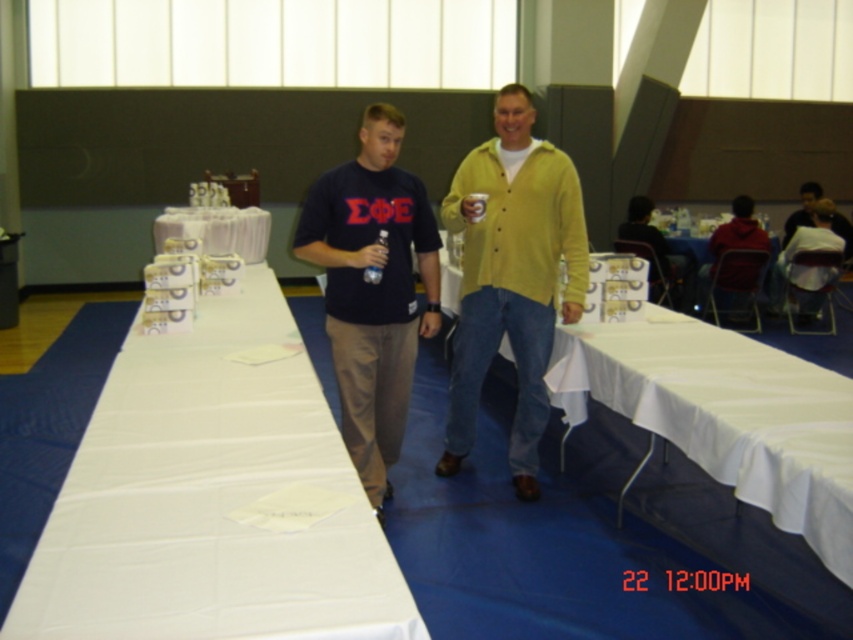
Between yellow matte cardigan at center and white cardboard boxes at center, which one is positioned higher?

Positioned higher is white cardboard boxes at center.

Does yellow matte cardigan at center appear over white cardboard boxes at center?

No.

Does point (511, 173) lie behind point (175, 212)?

No, it is not.

Locate an element on the screen. The image size is (853, 640). yellow matte cardigan at center is located at coordinates pyautogui.click(x=511, y=275).

Can you confirm if dark blue t-shirt at center is shorter than matte black t-shirt at center?

In fact, dark blue t-shirt at center may be taller than matte black t-shirt at center.

The image size is (853, 640). What do you see at coordinates (512, 276) in the screenshot?
I see `dark blue t-shirt at center` at bounding box center [512, 276].

This screenshot has height=640, width=853. I want to click on dark blue t-shirt at center, so click(x=512, y=276).

Does white fabric table at center appear over dark blue t-shirt at center?

No.

Between white fabric table at center and dark blue t-shirt at center, which one is positioned higher?

dark blue t-shirt at center is above.

Image resolution: width=853 pixels, height=640 pixels. I want to click on white fabric table at center, so click(212, 499).

Image resolution: width=853 pixels, height=640 pixels. I want to click on white fabric table at center, so click(x=212, y=499).